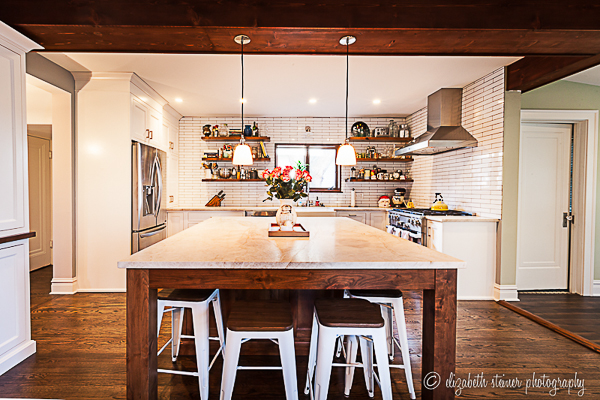
The width and height of the screenshot is (600, 400). What are the coordinates of `shelf` in the screenshot? It's located at click(218, 137), click(216, 156), click(224, 178), click(364, 140), click(365, 156), click(351, 179).